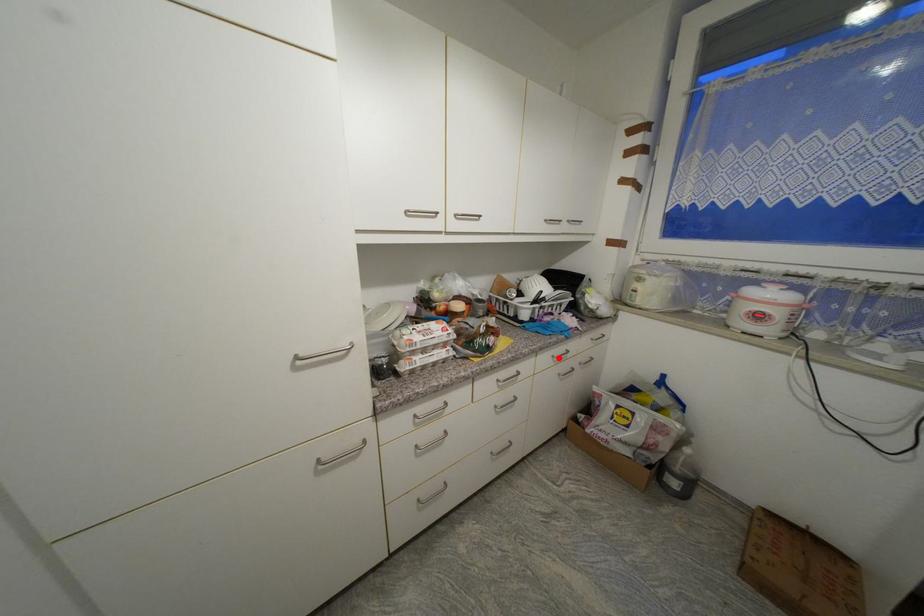
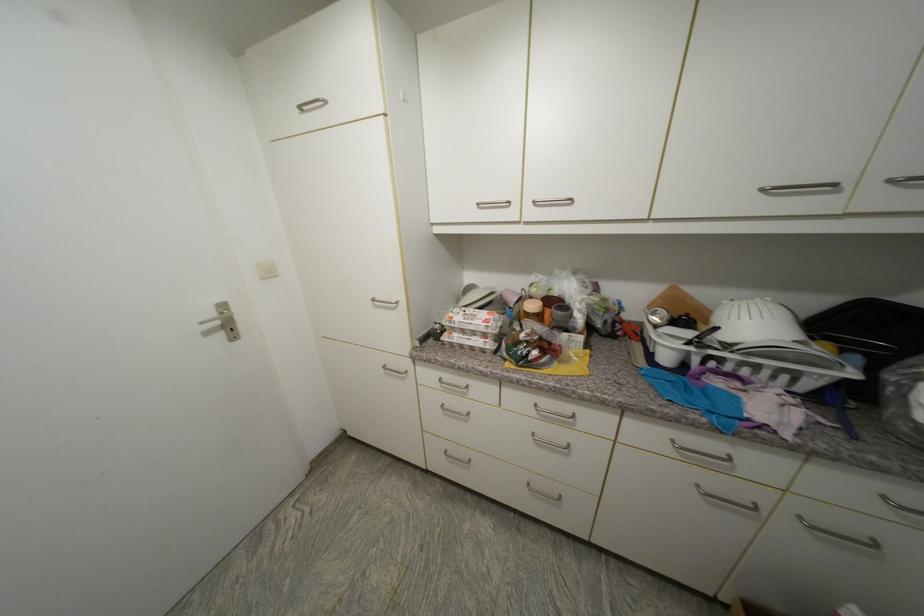
Find the pixel in the second image that matches the highlighted location in the first image.

(678, 443)